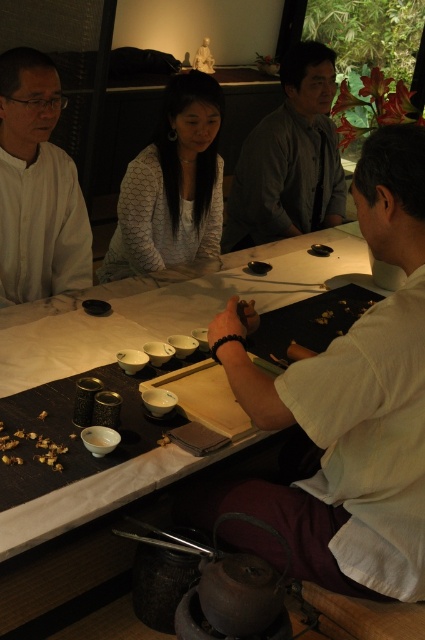
Question: Is black wood table at center to the left of white textured sweater at center from the viewer's perspective?

Choices:
 (A) yes
 (B) no

Answer: (B)

Question: Which object is positioned farthest from the brown crumbly food at lower left?

Choices:
 (A) white matte shirt at left
 (B) wooden chopsticks at center
 (C) white matte shirt at center

Answer: (A)

Question: Estimate the real-world distances between objects in this image. Which object is farther from the white matte shirt at center?

Choices:
 (A) black wood table at center
 (B) white matte shirt at left

Answer: (B)

Question: Considering the relative positions of white matte shirt at center and wooden chopsticks at center in the image provided, where is white matte shirt at center located with respect to wooden chopsticks at center?

Choices:
 (A) above
 (B) below

Answer: (A)

Question: Does black wood table at center have a lesser width compared to wooden chopsticks at center?

Choices:
 (A) yes
 (B) no

Answer: (B)

Question: Which point is farther from the camera taking this photo?

Choices:
 (A) (357, 236)
 (B) (28, 285)
 (C) (172, 211)

Answer: (A)